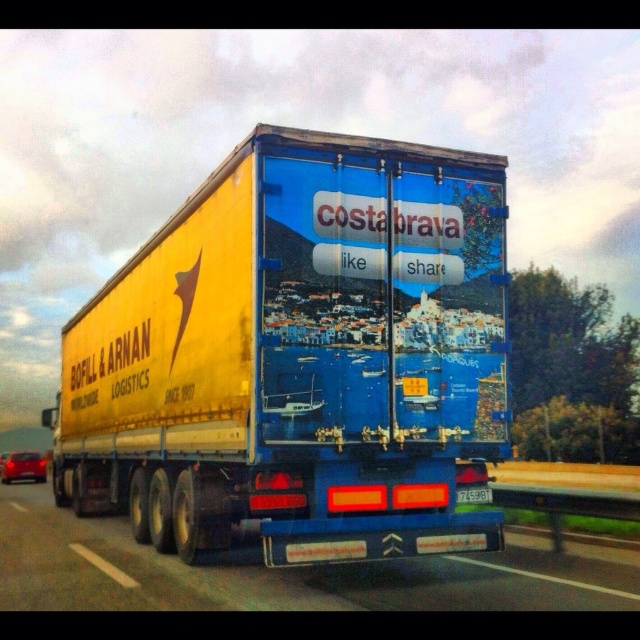
Question: Which point is closer to the camera?

Choices:
 (A) (179, 416)
 (B) (614, 605)

Answer: (B)

Question: Is yellow matte trailer at center below blue glossy truck at center?

Choices:
 (A) yes
 (B) no

Answer: (A)

Question: Can you confirm if yellow matte trailer at center is positioned below blue glossy truck at center?

Choices:
 (A) yes
 (B) no

Answer: (A)

Question: Can you confirm if yellow matte trailer at center is positioned to the right of blue glossy truck at center?

Choices:
 (A) yes
 (B) no

Answer: (B)

Question: Which object is closer to the camera taking this photo?

Choices:
 (A) yellow matte trailer at center
 (B) blue glossy truck at center

Answer: (A)

Question: Which point appears farthest from the camera in this image?

Choices:
 (A) (269, 220)
 (B) (90, 604)

Answer: (B)